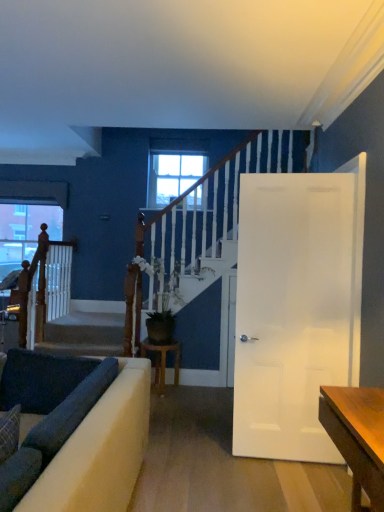
Question: Is dark fabric cushion at lower left aimed at wooden stool at center?

Choices:
 (A) yes
 (B) no

Answer: (B)

Question: Is dark fabric cushion at lower left positioned behind wooden stool at center?

Choices:
 (A) yes
 (B) no

Answer: (B)

Question: Is dark fabric cushion at lower left oriented away from wooden stool at center?

Choices:
 (A) yes
 (B) no

Answer: (A)

Question: Is dark fabric cushion at lower left far away from wooden stool at center?

Choices:
 (A) no
 (B) yes

Answer: (B)

Question: From the image's perspective, is dark fabric cushion at lower left on top of wooden stool at center?

Choices:
 (A) no
 (B) yes

Answer: (B)

Question: In the image, is dark fabric cushion at lower left positioned in front of or behind wooden stool at center?

Choices:
 (A) front
 (B) behind

Answer: (A)

Question: Is dark fabric cushion at lower left wider or thinner than wooden stool at center?

Choices:
 (A) thin
 (B) wide

Answer: (A)

Question: Does point (13, 391) appear closer or farther from the camera than point (158, 344)?

Choices:
 (A) farther
 (B) closer

Answer: (B)

Question: Do you think dark fabric cushion at lower left is within wooden stool at center, or outside of it?

Choices:
 (A) inside
 (B) outside

Answer: (B)

Question: From a real-world perspective, is wooden stool at center above or below clear glass window at center, positioned as the 2th window in left-to-right order?

Choices:
 (A) below
 (B) above

Answer: (A)

Question: Is point (157, 388) closer or farther from the camera than point (172, 189)?

Choices:
 (A) farther
 (B) closer

Answer: (B)

Question: In the image, is wooden stool at center positioned in front of or behind clear glass window at center, positioned as the 2th window in left-to-right order?

Choices:
 (A) behind
 (B) front

Answer: (B)

Question: In terms of height, does wooden stool at center look taller or shorter compared to clear glass window at center, arranged as the first window when viewed from the right?

Choices:
 (A) short
 (B) tall

Answer: (A)

Question: In terms of width, does dark fabric cushion at lower left look wider or thinner when compared to smooth concrete stairs at center?

Choices:
 (A) thin
 (B) wide

Answer: (A)

Question: Considering the positions of dark fabric cushion at lower left and smooth concrete stairs at center in the image, is dark fabric cushion at lower left taller or shorter than smooth concrete stairs at center?

Choices:
 (A) short
 (B) tall

Answer: (B)